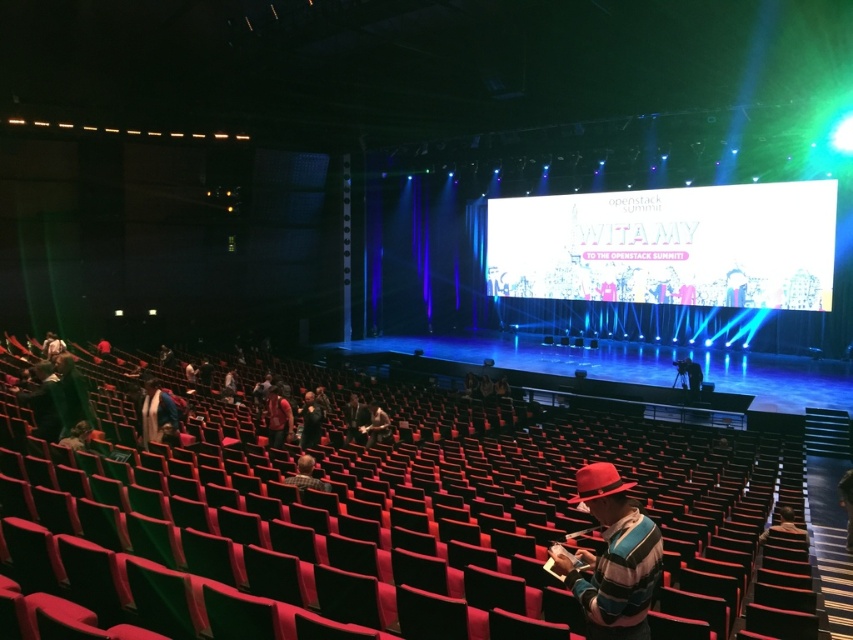
Does dark gray hoodie at center have a lesser height compared to matte black jacket at center?

Incorrect, dark gray hoodie at center's height does not fall short of matte black jacket at center's.

Does dark gray hoodie at center appear on the left side of matte black jacket at center?

Correct, you'll find dark gray hoodie at center to the left of matte black jacket at center.

Does point (315, 424) come closer to viewer compared to point (390, 438)?

Yes, point (315, 424) is in front of point (390, 438).

Identify the location of dark gray hoodie at center. (310, 420).

Between white fabric at lower left and matte black jacket at center, which one is positioned higher?

white fabric at lower left is above.

Who is lower down, white fabric at lower left or matte black jacket at center?

matte black jacket at center is lower down.

Who is more forward, (x=165, y=401) or (x=375, y=428)?

Positioned in front is point (x=165, y=401).

Where is `white fabric at lower left`? This screenshot has height=640, width=853. white fabric at lower left is located at coordinates (157, 413).

Can you confirm if matte red shirt at center is shorter than plaid shirt at lower center?

No.

Where is `matte red shirt at center`? matte red shirt at center is located at coordinates (277, 417).

Between point (273, 410) and point (312, 484), which one is positioned behind?

The point (273, 410) is behind.

Find the location of `matte red shirt at center`. matte red shirt at center is located at coordinates (277, 417).